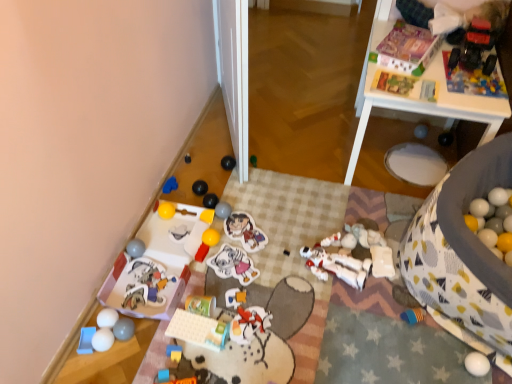
Locate an element on the screen. free space in front of rubberized plastic toy truck at upper right, the first toy viewed from the right is located at coordinates (476, 86).